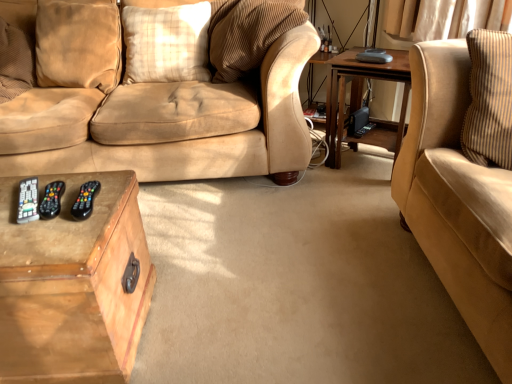
At what (x,y) coordinates should I click in order to perform the action: click on free space on the front side of black plastic remote at lower left. Please return your answer as a coordinate pair (x, y). Image resolution: width=512 pixels, height=384 pixels. Looking at the image, I should click on 33,238.